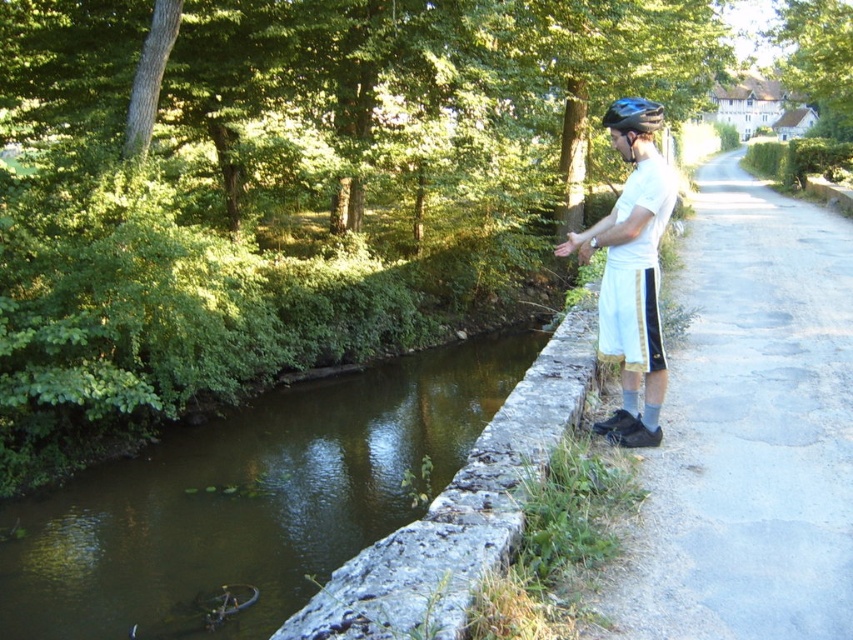
You are a pedestrian walking along the path next to the waterway. You notice the white cotton shorts at right and the blue matte bicycle helmet at upper center. Which object is closer to the waterway?

The white cotton shorts at right is positioned under the blue matte bicycle helmet at upper center, meaning it is closer to the waterway.

You are a fashion designer analyzing the image. You need to determine which item is narrower between the white cotton shorts at right and the blue matte bicycle helmet at upper center. Which one is narrower?

The white cotton shorts at right are narrower than the blue matte bicycle helmet at upper center since the white cotton shorts at right has a smaller width.

You are standing at the edge of the waterway and want to reach a specific point marked at coordinates point (640, 582). If your walking speed is 3 feet per second, how many seconds will it take you to reach that point?

The distance of point (640, 582) from viewer is 12.21 feet. At a speed of 3 feet per second, it will take 12.21 divided by 3, which is approximately 4.07 seconds to reach the point.